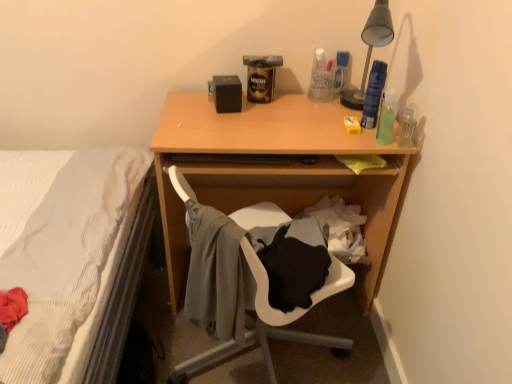
Question: Should I look upward or downward to see wooden desk at center?

Choices:
 (A) down
 (B) up

Answer: (A)

Question: Can you confirm if clear plastic bottle at right, the second bottle from the front, is thinner than wooden desk at center?

Choices:
 (A) yes
 (B) no

Answer: (A)

Question: Does clear plastic bottle at right, the second bottle from the front, have a larger size compared to wooden desk at center?

Choices:
 (A) yes
 (B) no

Answer: (B)

Question: From a real-world perspective, is clear plastic bottle at right, which is the 3th bottle in back-to-front order, physically above wooden desk at center?

Choices:
 (A) no
 (B) yes

Answer: (B)

Question: Can we say clear plastic bottle at right, the second bottle from the front, lies outside wooden desk at center?

Choices:
 (A) no
 (B) yes

Answer: (B)

Question: Is clear plastic bottle at right, which is the 3th bottle in back-to-front order, to the right of wooden desk at center from the viewer's perspective?

Choices:
 (A) no
 (B) yes

Answer: (B)

Question: From a real-world perspective, is clear plastic bottle at right, which is the 3th bottle in back-to-front order, physically below wooden desk at center?

Choices:
 (A) yes
 (B) no

Answer: (B)

Question: Does translucent plastic bottle at upper right, placed as the 1th bottle when sorted from back to front, have a smaller size compared to translucent green bottle at right, arranged as the fourth bottle when viewed from the back?

Choices:
 (A) yes
 (B) no

Answer: (A)

Question: Is there a large distance between translucent plastic bottle at upper right, placed as the 1th bottle when sorted from back to front, and translucent green bottle at right, marked as the 1th bottle in a front-to-back arrangement?

Choices:
 (A) no
 (B) yes

Answer: (A)

Question: Is translucent plastic bottle at upper right, placed as the 1th bottle when sorted from back to front, next to translucent green bottle at right, arranged as the fourth bottle when viewed from the back, and touching it?

Choices:
 (A) no
 (B) yes

Answer: (A)

Question: From the image's perspective, would you say translucent plastic bottle at upper right, which is the fourth bottle from front to back, is positioned over translucent green bottle at right, marked as the 1th bottle in a front-to-back arrangement?

Choices:
 (A) no
 (B) yes

Answer: (B)

Question: Is translucent plastic bottle at upper right, placed as the 1th bottle when sorted from back to front, bigger than translucent green bottle at right, marked as the 1th bottle in a front-to-back arrangement?

Choices:
 (A) no
 (B) yes

Answer: (A)

Question: Does translucent plastic bottle at upper right, which is the fourth bottle from front to back, have a lesser height compared to translucent green bottle at right, marked as the 1th bottle in a front-to-back arrangement?

Choices:
 (A) yes
 (B) no

Answer: (B)

Question: Does translucent plastic spray can at upper right, marked as the 3th bottle in a front-to-back arrangement, have a smaller size compared to black matte speaker at upper center?

Choices:
 (A) yes
 (B) no

Answer: (A)